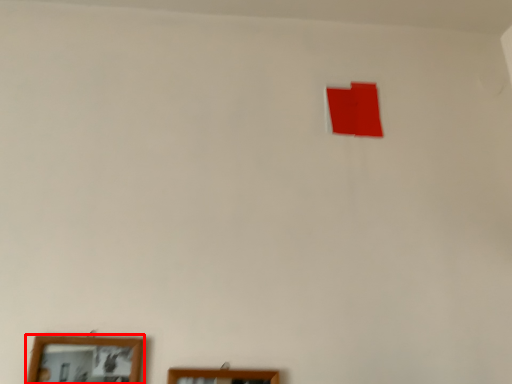
Question: Observing the image, what is the correct spatial positioning of picture frame (annotated by the red box) in reference to picture frame?

Choices:
 (A) left
 (B) right

Answer: (A)